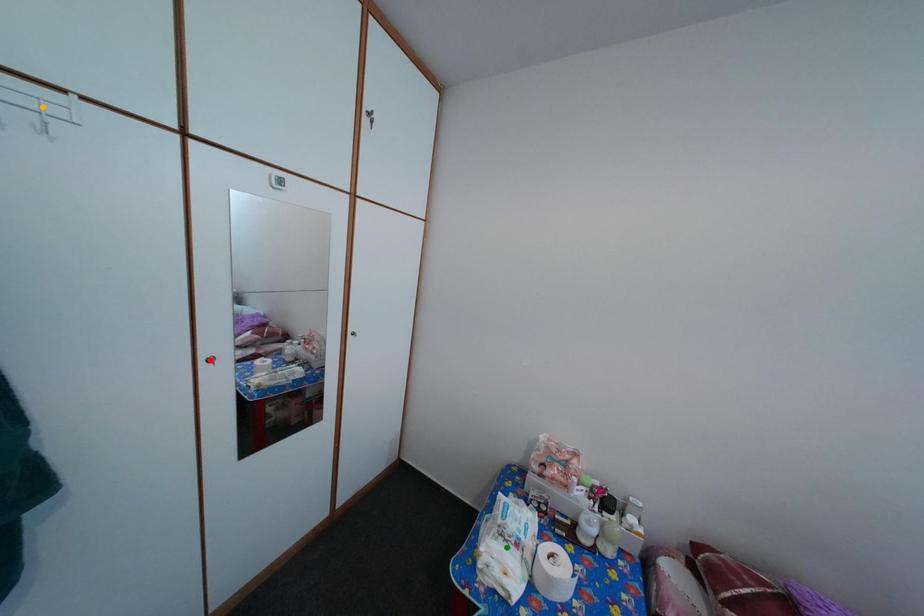
Order these from nearest to farthest:
1. orange point
2. green point
3. red point

1. red point
2. green point
3. orange point